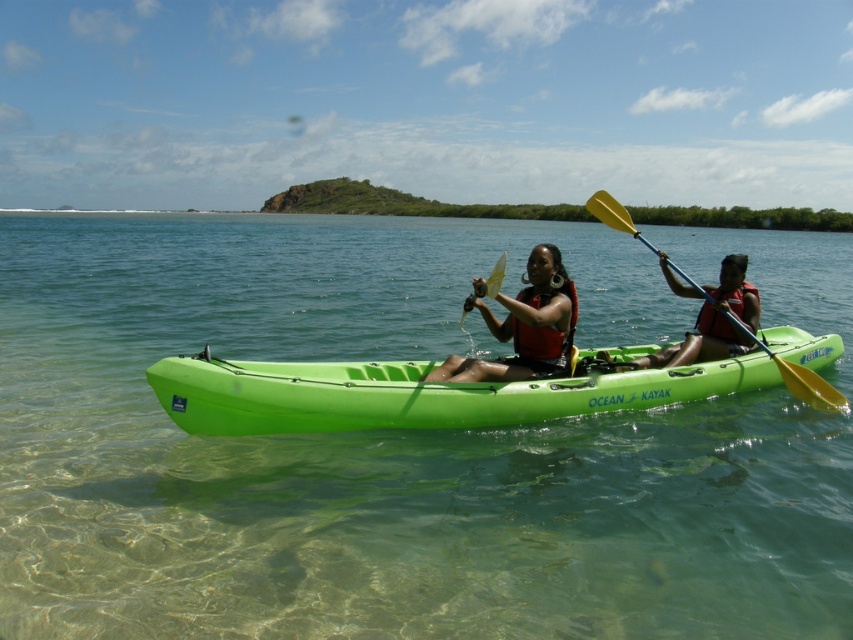
You are a photographer taking a picture of the matte black life vest at center and the yellow plastic paddle at right. Which object should you focus on first to ensure both are in sharp focus?

You should focus on the matte black life vest at center first because it is closer to the camera than the yellow plastic paddle at right, ensuring both will be in focus when using depth of field techniques.

You are standing at the point labeled as point (x=553, y=368) and want to retrieve a floating item that is exactly 5 meters away from you in the direction facing the peninsula. Can you safely reach it without entering water deeper than 1 meter?

The distance between you and the viewer is 7.35 meters. Since the floating item is only 5 meters away from you, it is within the safe range where the water is shallow and clear, revealing the sandy bottom. Therefore, you can safely retrieve it without entering water deeper than 1 meter.

You are a safety inspector checking the equipment in the kayak. You notice the matte black life vest at center and the yellow plastic paddle at right. Which item is bigger in size?

The matte black life vest at center is larger in size than the yellow plastic paddle at right.